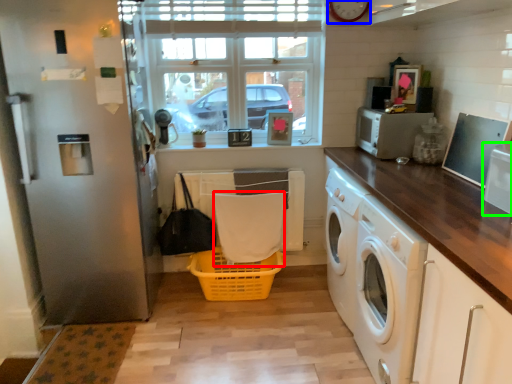
Question: Estimate the real-world distances between objects in this image. Which object is farther from material (highlighted by a red box), clock (highlighted by a blue box) or appliance (highlighted by a green box)?

Choices:
 (A) clock
 (B) appliance

Answer: (B)